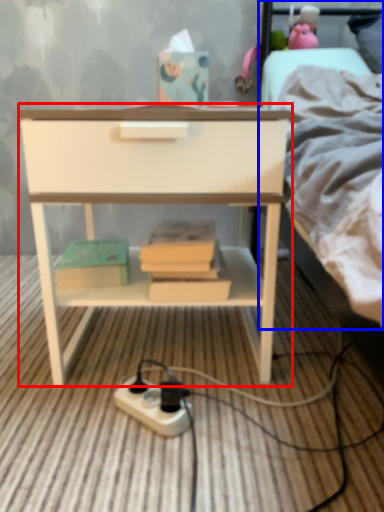
Question: Among these objects, which one is farthest to the camera, nightstand (highlighted by a red box) or bed (highlighted by a blue box)?

Choices:
 (A) nightstand
 (B) bed

Answer: (B)